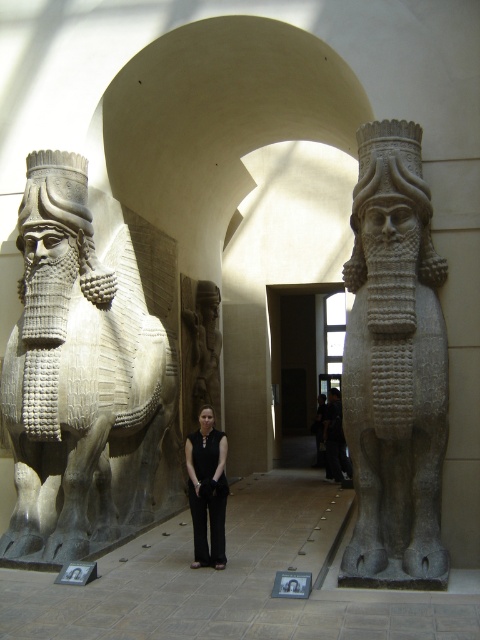
Does gray stone lion at left have a larger size compared to gray stone lion at right?

Correct, gray stone lion at left is larger in size than gray stone lion at right.

Between point (155, 435) and point (408, 566), which one is positioned in front?

Point (408, 566) is more forward.

Where is `gray stone lion at left`? gray stone lion at left is located at coordinates (86, 371).

Who is positioned more to the right, gray stone relief at center or black fabric pants at center?

black fabric pants at center

Is gray stone relief at center below black fabric pants at center?

No, gray stone relief at center is not below black fabric pants at center.

Which is behind, point (188, 426) or point (212, 534)?

The point (188, 426) is more distant.

At what (x,y) coordinates should I click in order to perform the action: click on gray stone relief at center. Please return your answer as a coordinate pair (x, y). Looking at the image, I should click on (200, 349).

The image size is (480, 640). What are the coordinates of `gray stone lion at right` in the screenshot? It's located at (395, 368).

Which is below, gray stone lion at right or gray stone relief at center?

gray stone relief at center is lower down.

The image size is (480, 640). What are the coordinates of `gray stone lion at right` in the screenshot? It's located at (395, 368).